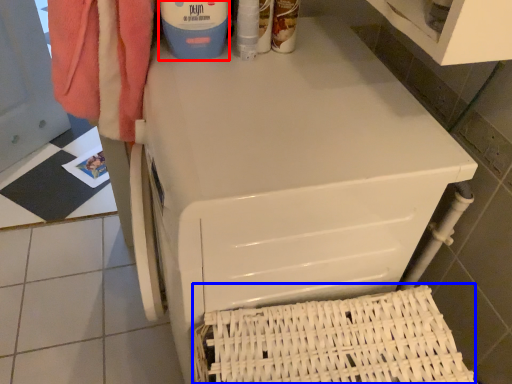
Question: Which object is closer to the camera taking this photo, cleaning product (highlighted by a red box) or basket (highlighted by a blue box)?

Choices:
 (A) cleaning product
 (B) basket

Answer: (B)